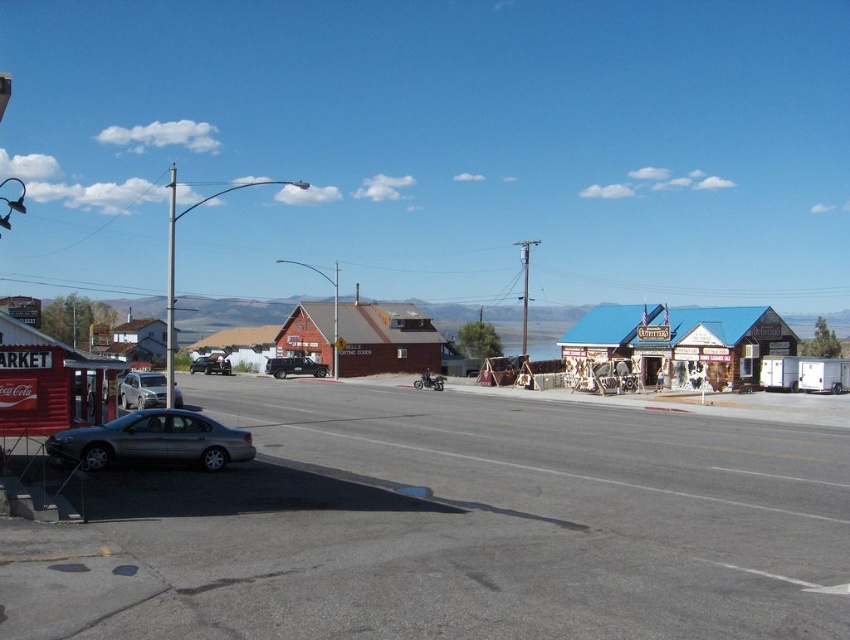
In the scene shown: You are standing at the point labeled point [171,413] and want to walk to point [171,204]. Based on the scene description, will you be moving towards or away from the camera?

You will be moving away from the camera because point [171,204] is further from the camera than point [171,413].

You are a delivery driver who needs to park your vehicle near the red building with the Coca Cola sign. The parking spot must be between the satin silver sedan at lower left and the metallic pole at left. Is there enough space for your vehicle, which is 5 meters long?

The satin silver sedan at lower left is located below metallic pole at left, but the distance between them isn not specified. Without knowing the exact distance, it is impossible to determine if there is enough space for a 5 meter long vehicle.

You are a delivery person needing to park your vehicle in this town scene. You have a large delivery truck that requires more space than a regular car. Based on the scene, which object can you use as a reference to determine if there is enough space for your truck near the rustic wood cabin at center and the silver metallic car at left?

The rustic wood cabin at center is larger than the silver metallic car at left. Since the cabin is bigger, you can use its size as a reference to estimate if there is enough space for your truck near it.